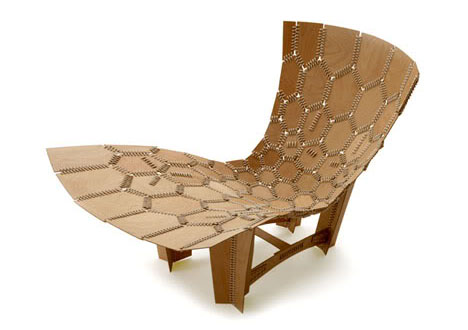
Identify the location of right chair leg. This screenshot has height=330, width=468. (236, 270).